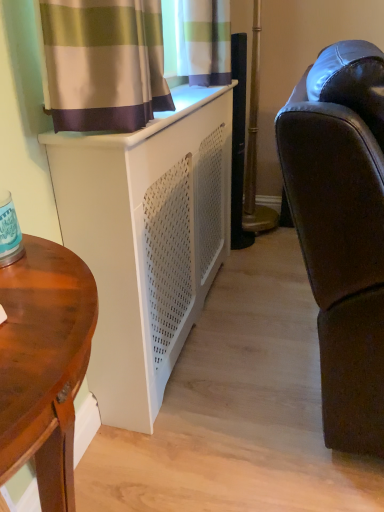
Question: Is wooden desk at left in front of white matte cabinet at lower left?

Choices:
 (A) yes
 (B) no

Answer: (A)

Question: Does wooden desk at left touch white matte cabinet at lower left?

Choices:
 (A) no
 (B) yes

Answer: (A)

Question: From a real-world perspective, is wooden desk at left positioned under white matte cabinet at lower left based on gravity?

Choices:
 (A) yes
 (B) no

Answer: (A)

Question: Can we say wooden desk at left lies outside white matte cabinet at lower left?

Choices:
 (A) no
 (B) yes

Answer: (B)

Question: Is white matte cabinet at lower left at the back of wooden desk at left?

Choices:
 (A) yes
 (B) no

Answer: (B)

Question: Would you say matte black leather couch at right is inside or outside white matte cabinet at lower left?

Choices:
 (A) inside
 (B) outside

Answer: (B)

Question: Looking at the image, does matte black leather couch at right seem bigger or smaller compared to white matte cabinet at lower left?

Choices:
 (A) big
 (B) small

Answer: (A)

Question: Considering the positions of matte black leather couch at right and white matte cabinet at lower left in the image, is matte black leather couch at right taller or shorter than white matte cabinet at lower left?

Choices:
 (A) short
 (B) tall

Answer: (B)

Question: From a real-world perspective, is matte black leather couch at right positioned above or below white matte cabinet at lower left?

Choices:
 (A) above
 (B) below

Answer: (A)

Question: Looking at the image, does wooden desk at left seem bigger or smaller compared to white matte cabinet at lower left?

Choices:
 (A) small
 (B) big

Answer: (A)

Question: Relative to white matte cabinet at lower left, is wooden desk at left in front or behind?

Choices:
 (A) behind
 (B) front

Answer: (B)

Question: In terms of height, does wooden desk at left look taller or shorter compared to white matte cabinet at lower left?

Choices:
 (A) tall
 (B) short

Answer: (B)

Question: Is wooden desk at left inside the boundaries of white matte cabinet at lower left, or outside?

Choices:
 (A) inside
 (B) outside

Answer: (B)

Question: Is matte black leather couch at right spatially inside wooden desk at left, or outside of it?

Choices:
 (A) inside
 (B) outside

Answer: (B)

Question: Considering the positions of point (301, 148) and point (66, 472), is point (301, 148) closer or farther from the camera than point (66, 472)?

Choices:
 (A) closer
 (B) farther

Answer: (B)